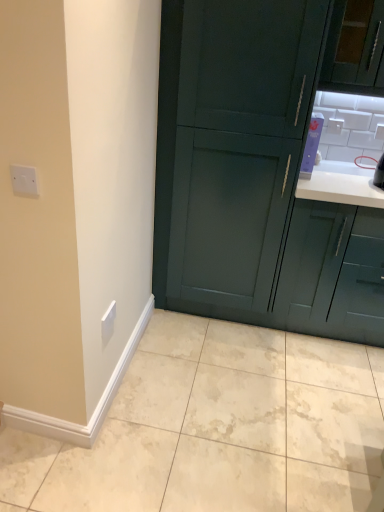
Question: Looking at their shapes, would you say beige marble tile at lower center is wider or thinner than matte teal cabinet at upper right, the second cabinetry in the left-to-right sequence?

Choices:
 (A) thin
 (B) wide

Answer: (B)

Question: Does point (152, 443) appear closer or farther from the camera than point (344, 266)?

Choices:
 (A) farther
 (B) closer

Answer: (B)

Question: Based on their relative distances, which object is farther from the white plastic electric outlet at upper right, which appears as the second electric outlet when viewed from the back?

Choices:
 (A) beige marble tile at lower center
 (B) matte teal cabinet at upper right, the second cabinetry in the left-to-right sequence
 (C) white plastic electric outlet at lower left, acting as the third electric outlet starting from the back
 (D) white glossy electric outlet at upper center, the fourth electric outlet from the front
 (E) dark green wood cabinet at center, placed as the 2th cabinetry when sorted from right to left

Answer: (A)

Question: Estimate the real-world distances between objects in this image. Which object is farther from the beige marble tile at lower center?

Choices:
 (A) white glossy electric outlet at upper center, which is counted as the 3th electric outlet, starting from the left
 (B) white plastic electric outlet at lower left, acting as the fourth electric outlet starting from the top
 (C) dark green wood cabinet at center, placed as the 2th cabinetry when sorted from right to left
 (D) white plastic electric outlet at upper left, acting as the fourth electric outlet starting from the right
 (E) matte teal cabinet at upper right, the second cabinetry in the left-to-right sequence

Answer: (A)